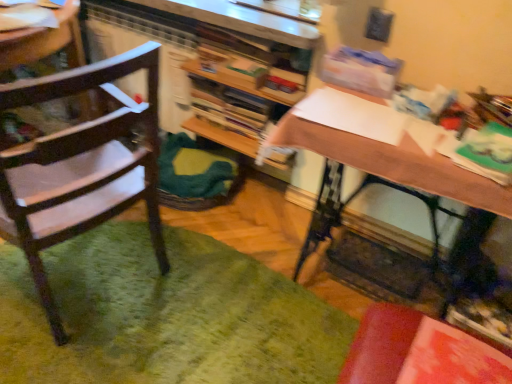
Find the location of `blank space above wooden desk at center (from a real-world perspective)`. blank space above wooden desk at center (from a real-world perspective) is located at coordinates (397, 122).